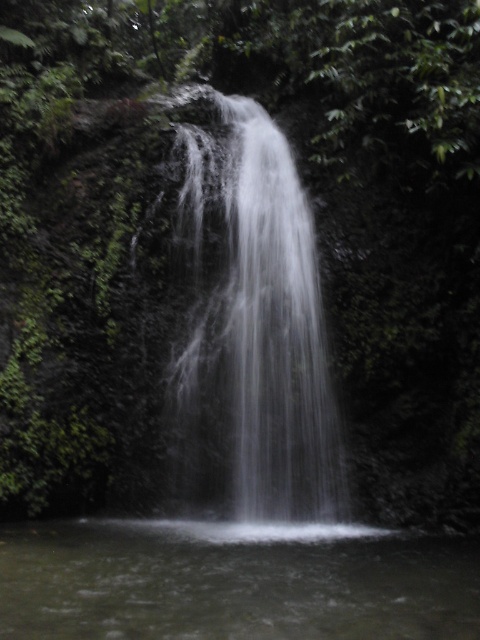
You are standing at the edge of the waterfall pool and want to cross to the other side. The white frothy water at center and clear water at center are in your path. Which part of the water should you avoid stepping on to safely cross?

You should avoid stepping on the white frothy water at center because it is above the clear water at center, indicating it is part of the falling water which is unsafe to walk through.

You are standing at the edge of the waterfall pool and notice two distinct areas of water. One is white frothy water at center and the other is clear water at center. Which area would you avoid stepping into if you want to stay dry?

You should avoid stepping into the white frothy water at center because it is to the right of clear water at center, and the mist from the cascading waterfall might make it wetter.